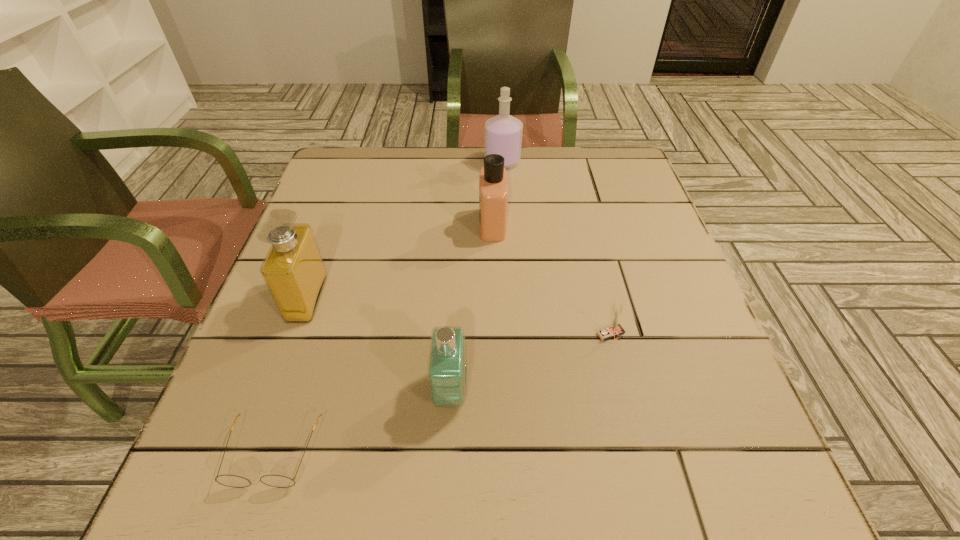
At what (x,y) coordinates should I click in order to perform the action: click on the farthest object. Please return your answer as a coordinate pair (x, y). The image size is (960, 540). Looking at the image, I should click on (503, 133).

At what (x,y) coordinates should I click in order to perform the action: click on the third farthest object. Please return your answer as a coordinate pair (x, y). Looking at the image, I should click on (293, 270).

Locate an element on the screen. the leftmost perfume is located at coordinates (293, 270).

What are the coordinates of `the fifth nearest object` in the screenshot? It's located at (493, 182).

Identify the location of the third object from left to right. The height and width of the screenshot is (540, 960). (447, 360).

Find the location of a particular element. The height and width of the screenshot is (540, 960). the nearest perfume is located at coordinates coord(447,360).

Where is `matchbox`? The width and height of the screenshot is (960, 540). matchbox is located at coordinates (615, 329).

Where is `the fourth farthest object`? Image resolution: width=960 pixels, height=540 pixels. the fourth farthest object is located at coordinates (615, 329).

The image size is (960, 540). Find the location of `the shortest object`. the shortest object is located at coordinates (278, 481).

Where is `vacant region located 0.070m on the left of the farthest perfume`? vacant region located 0.070m on the left of the farthest perfume is located at coordinates (460, 161).